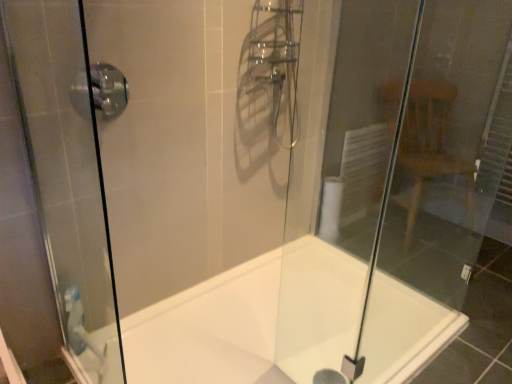
Locate an element on the screen. Image resolution: width=512 pixels, height=384 pixels. vacant area to the right of transparent glass door at right is located at coordinates (452, 276).